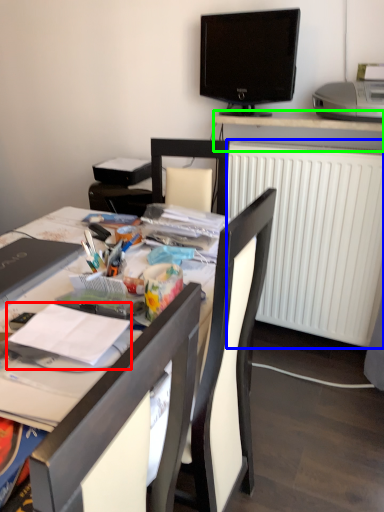
Question: Which object is positioned closest to magazine (highlighted by a red box)? Select from radiator (highlighted by a blue box) and desk (highlighted by a green box).

Choices:
 (A) radiator
 (B) desk

Answer: (A)